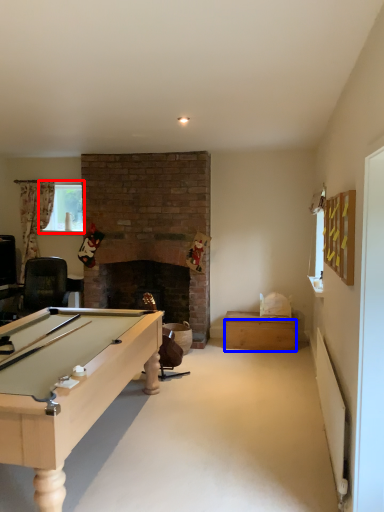
Question: Which object appears farthest to the camera in this image, window screen (highlighted by a red box) or drawer (highlighted by a blue box)?

Choices:
 (A) window screen
 (B) drawer

Answer: (A)